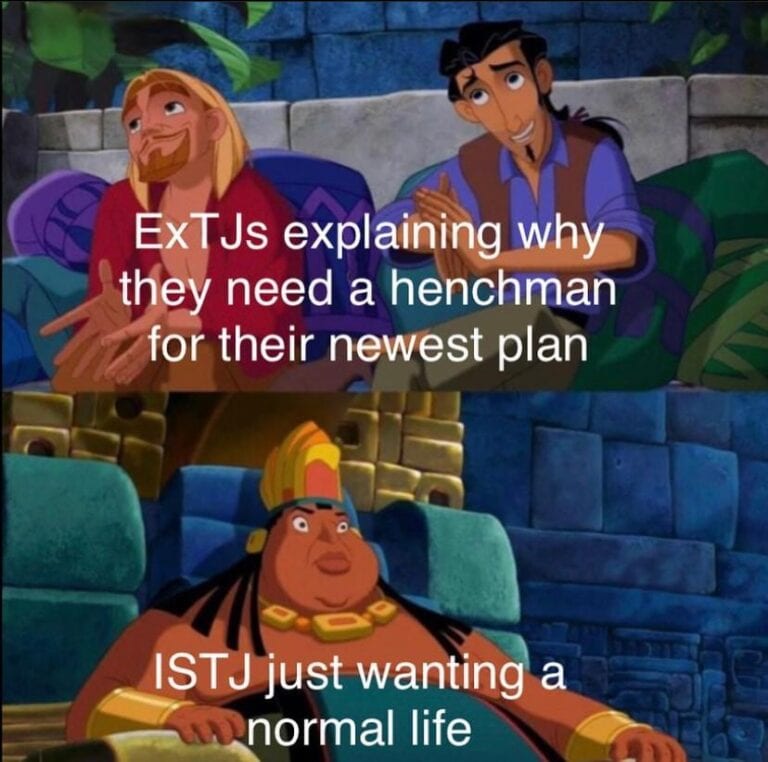
You are a GUI agent. You are given a task and a screenshot of the screen. Output one action in this format:
    pyautogui.click(x=<x>, y=<y>)
    Task: Click on the wall
    The width and height of the screenshot is (768, 762).
    Given the screenshot: What is the action you would take?
    pyautogui.click(x=379, y=43), pyautogui.click(x=621, y=43), pyautogui.click(x=666, y=482), pyautogui.click(x=104, y=431)